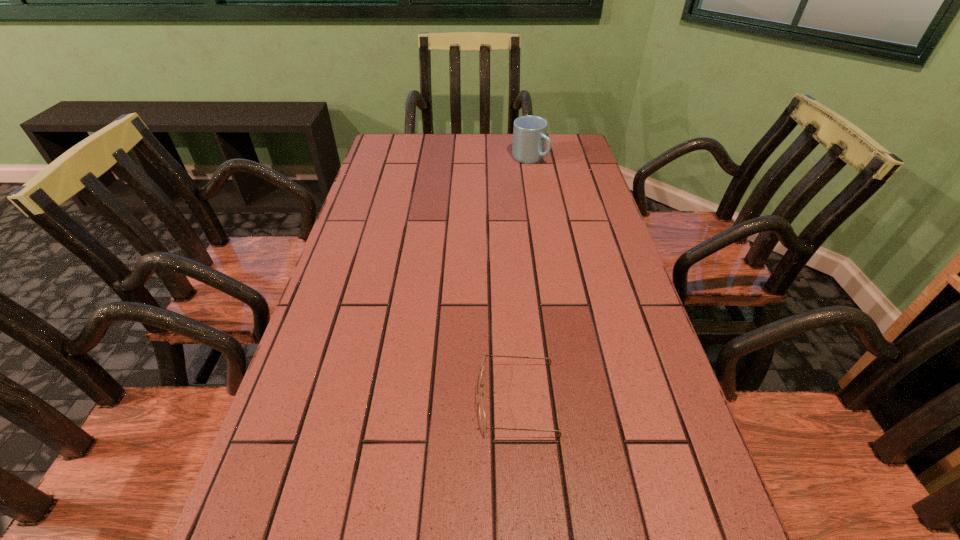
Where is `the taller object`? the taller object is located at coordinates (529, 132).

The width and height of the screenshot is (960, 540). Find the location of `mug`. mug is located at coordinates (529, 132).

What are the coordinates of `spectacles` in the screenshot? It's located at (483, 421).

The width and height of the screenshot is (960, 540). I want to click on the nearer object, so click(x=483, y=421).

At what (x,y) coordinates should I click in order to perform the action: click on vacant space situated 0.120m on the front of the farther object. Please return your answer as a coordinate pair (x, y). The height and width of the screenshot is (540, 960). Looking at the image, I should click on (535, 187).

At what (x,y) coordinates should I click in order to perform the action: click on vacant space situated 0.290m on the front-facing side of the nearer object. Please return your answer as a coordinate pair (x, y). Image resolution: width=960 pixels, height=540 pixels. Looking at the image, I should click on (324, 399).

Find the location of a particular element. vacant space located on the front-facing side of the nearer object is located at coordinates (394, 399).

Where is `free region located on the front-facing side of the nearer object`? Image resolution: width=960 pixels, height=540 pixels. free region located on the front-facing side of the nearer object is located at coordinates (383, 399).

Where is `object situated at the far edge`? Image resolution: width=960 pixels, height=540 pixels. object situated at the far edge is located at coordinates (x=529, y=132).

At what (x,y) coordinates should I click in order to perform the action: click on object present at the right edge. Please return your answer as a coordinate pair (x, y). This screenshot has height=540, width=960. Looking at the image, I should click on (529, 132).